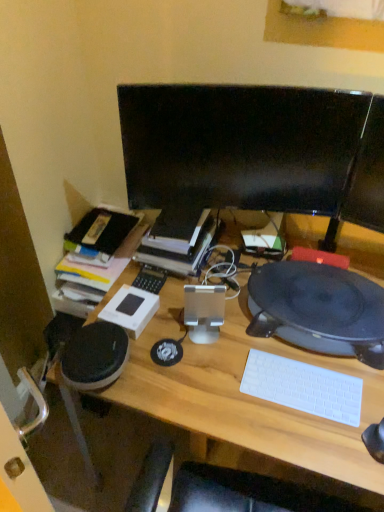
In order to click on free space between white plastic keyboard at lower right and black matte record player at right in this screenshot , I will do `click(296, 362)`.